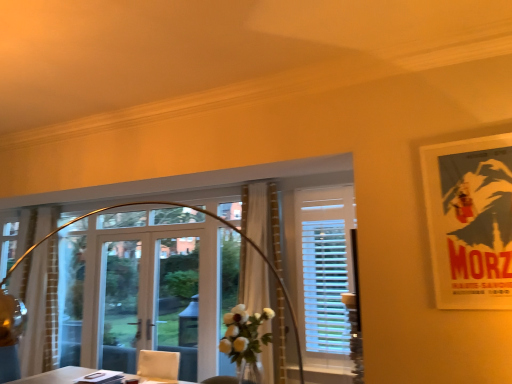
The width and height of the screenshot is (512, 384). What are the coordinates of `free point above white plastic blinds at center, placed as the 2th window when sorted from front to back (from a real-world perspective)` in the screenshot? It's located at (319, 175).